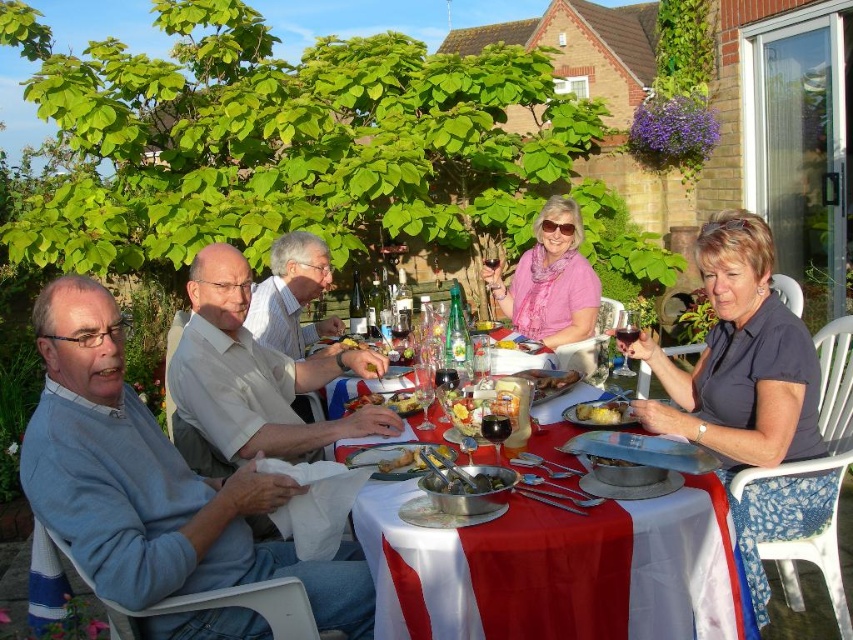
You are planning to place a decorative vase on the table in the image. The pink fabric scarf at center is currently on the table. Can you place the vase on the white glossy table at center without moving the scarf?

The white glossy table at center is located below the pink fabric scarf at center, so the scarf is on top of the table. You can place the vase on the table next to the scarf without moving it.

You are planning to place a decorative centerpiece on the white glossy table at center. Given its coordinates at point 0.900, 0.676, will it be centered on the table?

The white glossy table at center is already positioned at point (576,576), so placing the decorative centerpiece at the same coordinates will center it on the table.

You are planning to place a decorative centerpiece on the white glossy table at center where the shiny silver tongs at center are currently located. Considering their sizes, will the table have enough space to accommodate the new centerpiece without moving the tongs?

The white glossy table at center is larger in size compared to the shiny silver tongs at center. Therefore, there should be sufficient space on the table to place the decorative centerpiece alongside the tongs without needing to move them.